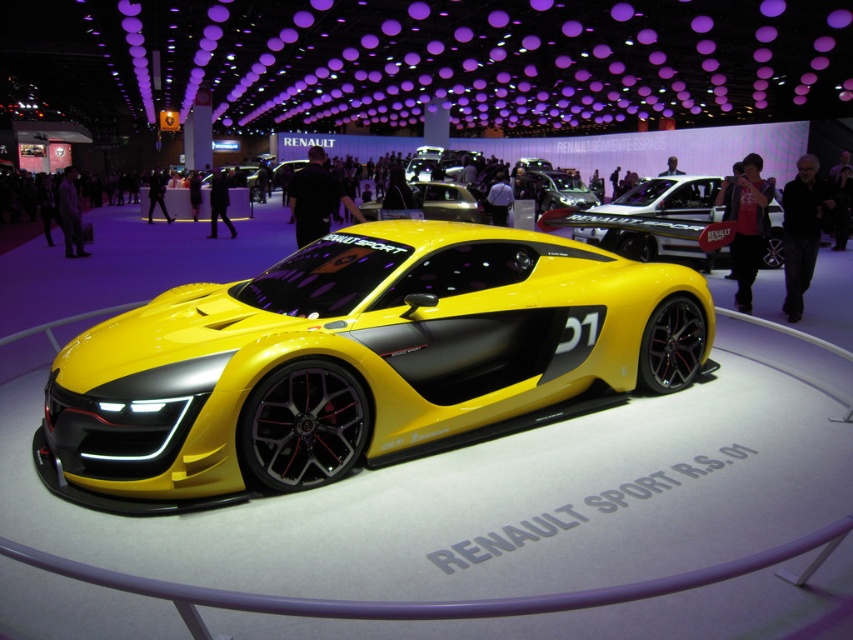
Question: Is yellow matte/satin sports car at center to the left of yellow matte/soft-touch concept car at center from the viewer's perspective?

Choices:
 (A) yes
 (B) no

Answer: (A)

Question: Can you confirm if yellow matte/satin sports car at center is positioned above yellow matte/soft-touch concept car at center?

Choices:
 (A) yes
 (B) no

Answer: (B)

Question: Which point is closer to the camera?

Choices:
 (A) (706, 189)
 (B) (625, 340)

Answer: (B)

Question: Among these objects, which one is nearest to the camera?

Choices:
 (A) yellow matte/soft-touch concept car at center
 (B) yellow matte/satin sports car at center

Answer: (B)

Question: Can you confirm if yellow matte/satin sports car at center is positioned to the right of yellow matte/soft-touch concept car at center?

Choices:
 (A) yes
 (B) no

Answer: (B)